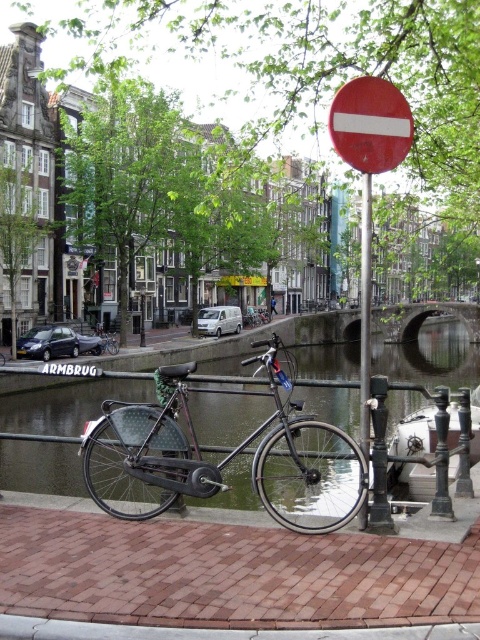
Question: Among these points, which one is nearest to the camera?

Choices:
 (A) (95, 339)
 (B) (156, 420)
 (C) (360, 346)

Answer: (B)

Question: Is red matte circle at upper center in front of metallic pole at center?

Choices:
 (A) no
 (B) yes

Answer: (B)

Question: Is metallic pole at center above shiny black bicycle at center?

Choices:
 (A) yes
 (B) no

Answer: (A)

Question: Which is farther from the shiny black bicycle at center?

Choices:
 (A) matte black bicycle at center
 (B) red matte circle at upper center
 (C) metallic pole at center

Answer: (B)

Question: Based on their relative distances, which object is nearer to the matte red circle at center?

Choices:
 (A) shiny black bicycle at center
 (B) matte black bicycle at center
 (C) metallic pole at center

Answer: (C)

Question: Does red matte circle at upper center have a lesser width compared to shiny black bicycle at center?

Choices:
 (A) no
 (B) yes

Answer: (B)